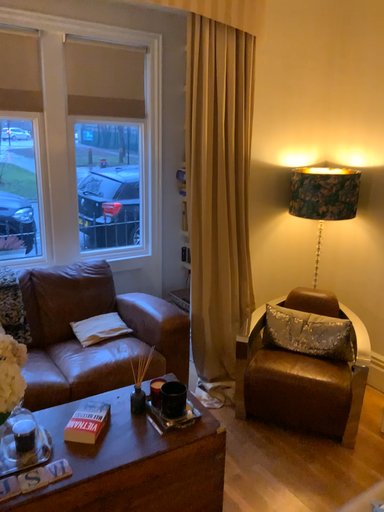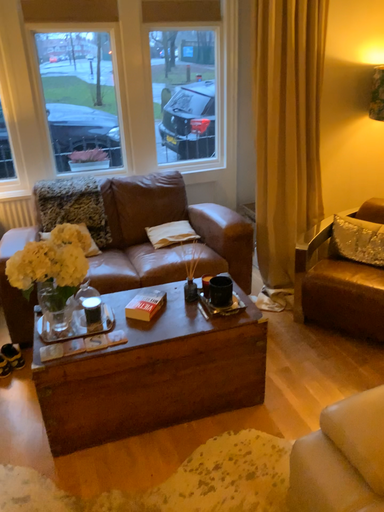
Question: How did the camera likely rotate when shooting the video?

Choices:
 (A) rotated left
 (B) rotated right

Answer: (A)